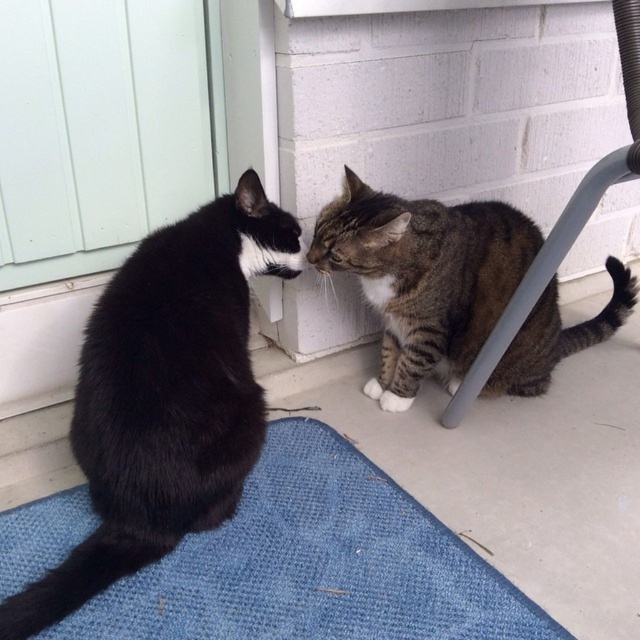
Is white wood screen door at upper left bigger than tabby fur cat at lower center?

No.

Is point (86, 225) closer to viewer compared to point (614, 321)?

Yes, point (86, 225) is closer to viewer.

Image resolution: width=640 pixels, height=640 pixels. I want to click on white wood screen door at upper left, so click(97, 129).

Based on the photo, can you confirm if blue textured mat at lower center is shorter than black fur cat at left?

Correct, blue textured mat at lower center is not as tall as black fur cat at left.

Which of these two, blue textured mat at lower center or black fur cat at left, stands taller?

black fur cat at left

At what (x,y) coordinates should I click in order to perform the action: click on blue textured mat at lower center. Please return your answer as a coordinate pair (x, y). This screenshot has height=640, width=640. Looking at the image, I should click on (316, 564).

At what (x,y) coordinates should I click in order to perform the action: click on blue textured mat at lower center. Please return your answer as a coordinate pair (x, y). This screenshot has height=640, width=640. Looking at the image, I should click on (316, 564).

Is point (364, 481) closer to viewer compared to point (17, 28)?

No, it is not.

Does blue textured mat at lower center have a lesser width compared to white wood screen door at upper left?

Incorrect, blue textured mat at lower center's width is not less than white wood screen door at upper left's.

The image size is (640, 640). In order to click on blue textured mat at lower center in this screenshot , I will do `click(316, 564)`.